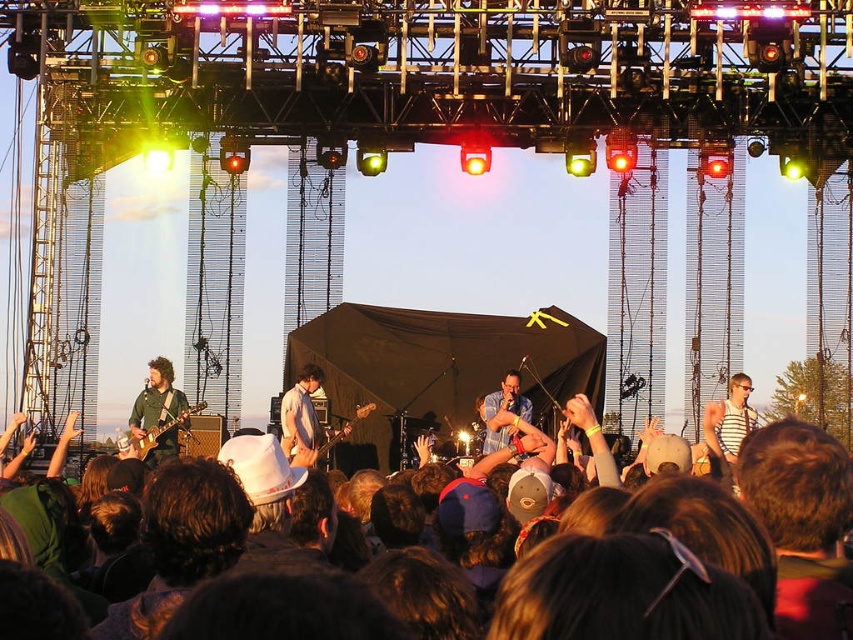
Question: Estimate the real-world distances between objects in this image. Which object is closer to the matte brown electric guitar at left?

Choices:
 (A) blue denim shirt at center
 (B) striped shirt at center
 (C) light blue fabric guitar at center

Answer: (C)

Question: Does shiny green guitar at left have a greater width compared to blue denim shirt at center?

Choices:
 (A) no
 (B) yes

Answer: (B)

Question: Which point appears farthest from the camera in this image?

Choices:
 (A) (126, 445)
 (B) (311, 392)

Answer: (B)

Question: Among these points, which one is farthest from the camera?

Choices:
 (A) (772, 461)
 (B) (291, 419)
 (C) (740, 413)
 (D) (503, 426)

Answer: (C)

Question: Can you confirm if shiny green guitar at left is bigger than matte brown electric guitar at left?

Choices:
 (A) yes
 (B) no

Answer: (A)

Question: Is light blue fabric guitar at center bigger than matte brown electric guitar at left?

Choices:
 (A) yes
 (B) no

Answer: (A)